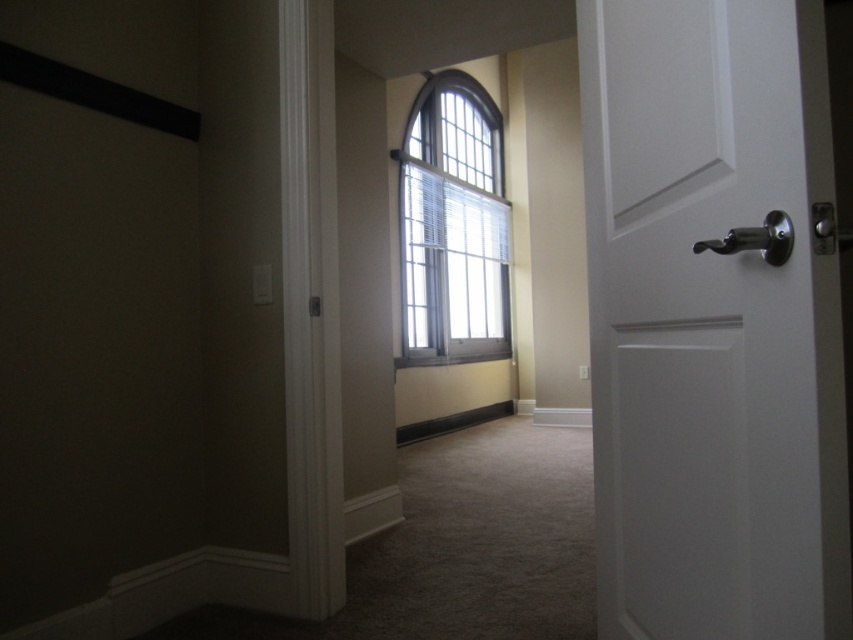
Question: Among these points, which one is nearest to the camera?

Choices:
 (A) (734, 417)
 (B) (459, 248)

Answer: (A)

Question: Is the position of white matte door at right less distant than that of clear glass window at center?

Choices:
 (A) yes
 (B) no

Answer: (A)

Question: Which point is farther to the camera?

Choices:
 (A) clear glass window at center
 (B) white matte door at right

Answer: (A)

Question: Considering the relative positions of white matte door at right and clear glass window at center in the image provided, where is white matte door at right located with respect to clear glass window at center?

Choices:
 (A) above
 (B) below

Answer: (B)

Question: Is white matte door at right above clear glass window at center?

Choices:
 (A) no
 (B) yes

Answer: (A)